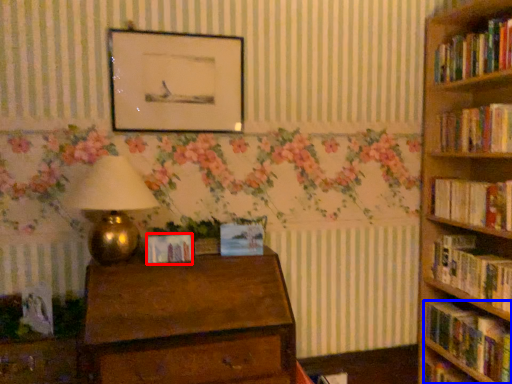
Question: Which object appears closest to the camera in this image, paperback book (highlighted by a red box) or book (highlighted by a blue box)?

Choices:
 (A) paperback book
 (B) book

Answer: (B)